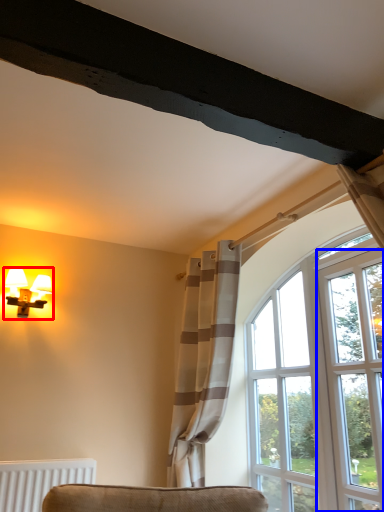
Question: Which of the following is the farthest to the observer, lamp (highlighted by a red box) or screen door (highlighted by a blue box)?

Choices:
 (A) lamp
 (B) screen door

Answer: (A)